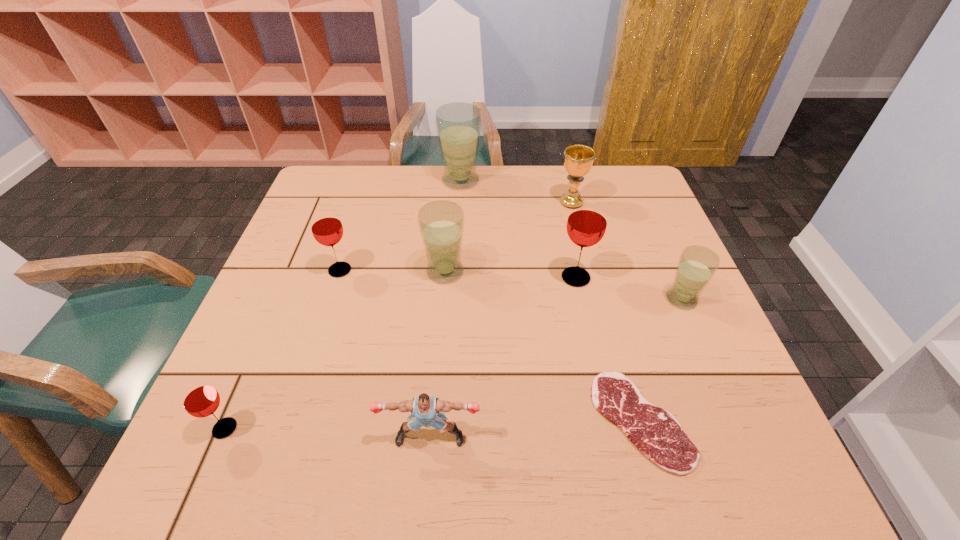
Locate an element on the screen. The height and width of the screenshot is (540, 960). vacant space located 0.120m on the right of the chalice is located at coordinates (626, 202).

This screenshot has height=540, width=960. What are the coordinates of `free space located on the left of the rightmost object` in the screenshot? It's located at (523, 300).

This screenshot has height=540, width=960. Identify the location of vacant space located on the right of the leftmost glass. (403, 428).

Image resolution: width=960 pixels, height=540 pixels. I want to click on vacant space positioned 0.090m on the back of the red steak, so click(x=618, y=339).

Identify the location of glass present at the far edge. (458, 124).

The image size is (960, 540). Find the location of `chalice located at the far edge`. chalice located at the far edge is located at coordinates (578, 160).

I want to click on puncher located at the near edge, so click(x=424, y=408).

Image resolution: width=960 pixels, height=540 pixels. Find the location of `glass present at the near edge`. glass present at the near edge is located at coordinates (200, 399).

Find the location of a particular element. This screenshot has height=540, width=960. steak situated at the near edge is located at coordinates (654, 431).

Identify the location of glass that is at the right edge. (697, 265).